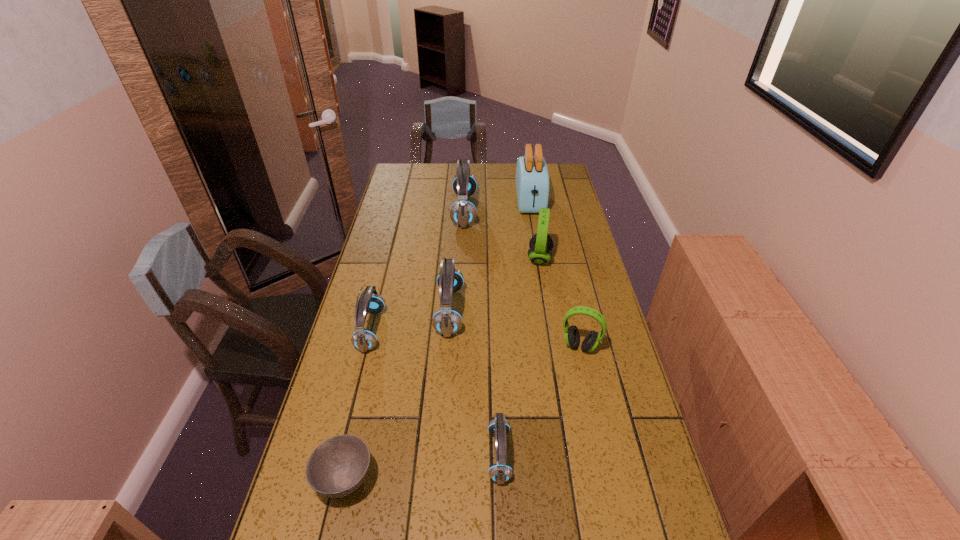
Where is `free spot located on the ear cups of the seventh tallest object`? Image resolution: width=960 pixels, height=540 pixels. free spot located on the ear cups of the seventh tallest object is located at coordinates (351, 455).

The image size is (960, 540). What are the coordinates of `vacant space located 0.220m on the ear cups of the seventh tallest object` in the screenshot? It's located at (397, 455).

I want to click on vacant space located 0.190m on the back of the shortest object, so click(367, 386).

Identify the location of headset at the left edge. (363, 339).

Locate an element on the screen. Image resolution: width=960 pixels, height=540 pixels. bowl positioned at the left edge is located at coordinates (338, 466).

You are a GUI agent. You are given a task and a screenshot of the screen. Output one action in this format:
    pyautogui.click(x=<x>, y=<y>)
    Task: Click on the toaster situated at the right edge
    The height and width of the screenshot is (540, 960).
    Given the screenshot: What is the action you would take?
    pyautogui.click(x=532, y=178)

Find the location of `free space at the far edge of the desktop`. free space at the far edge of the desktop is located at coordinates (492, 165).

Identify the location of free point at the left edge. The height and width of the screenshot is (540, 960). (353, 410).

Identify the location of blank space at the right edge of the desktop. The image size is (960, 540). (597, 278).

Find the location of a particular element. The image size is (960, 540). vacant space at the far right corner is located at coordinates (564, 170).